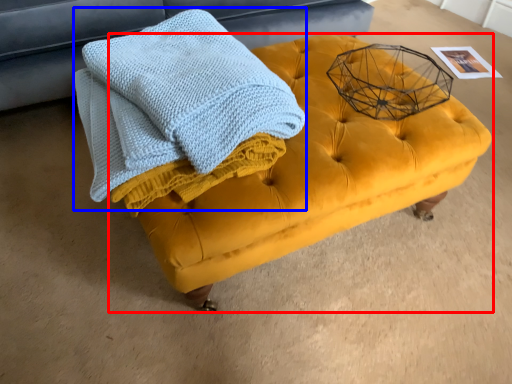
Question: Which object is closer to the camera taking this photo, table (highlighted by a red box) or bath towel (highlighted by a blue box)?

Choices:
 (A) table
 (B) bath towel

Answer: (B)